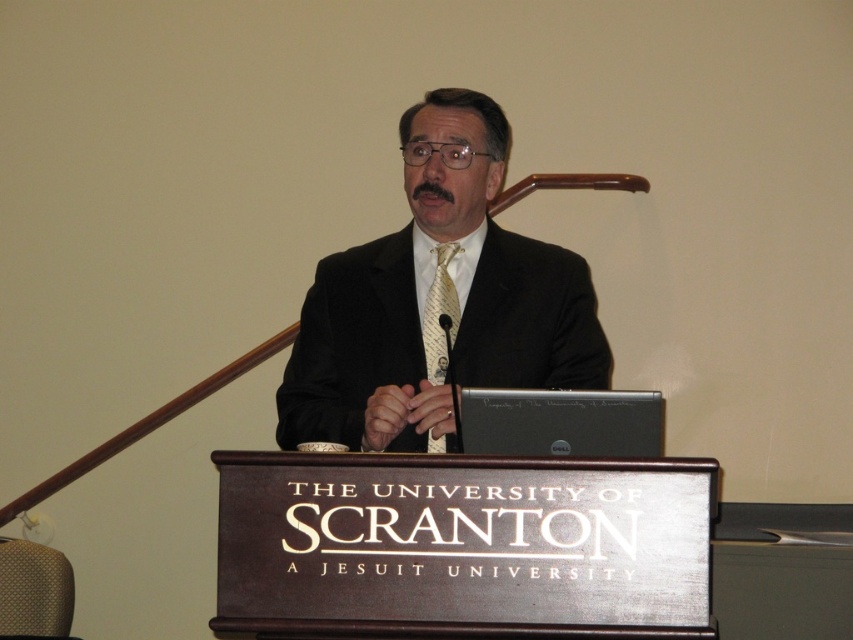
How much distance is there between black silk suit at center and black matte laptop at center?

black silk suit at center and black matte laptop at center are 56.79 centimeters apart from each other.

Can you confirm if black silk suit at center is positioned to the right of black matte laptop at center?

Incorrect, black silk suit at center is not on the right side of black matte laptop at center.

Who is more distant from viewer, (x=426, y=161) or (x=612, y=436)?

The point (x=426, y=161) is more distant.

This screenshot has height=640, width=853. Find the location of `black silk suit at center`. black silk suit at center is located at coordinates (437, 300).

Is black matte laptop at center wider than yellow silk tie at center?

Indeed, black matte laptop at center has a greater width compared to yellow silk tie at center.

Between black matte laptop at center and yellow silk tie at center, which one has less height?

With less height is black matte laptop at center.

Does point (604, 404) come farther from viewer compared to point (436, 273)?

No, it is in front of (436, 273).

I want to click on black matte laptop at center, so click(x=560, y=422).

Does black silk suit at center have a lesser width compared to yellow silk tie at center?

Incorrect, black silk suit at center's width is not less than yellow silk tie at center's.

Identify the location of black silk suit at center. (437, 300).

Is point (469, 144) farther from camera compared to point (444, 292)?

No, (469, 144) is in front of (444, 292).

I want to click on black silk suit at center, so click(x=437, y=300).